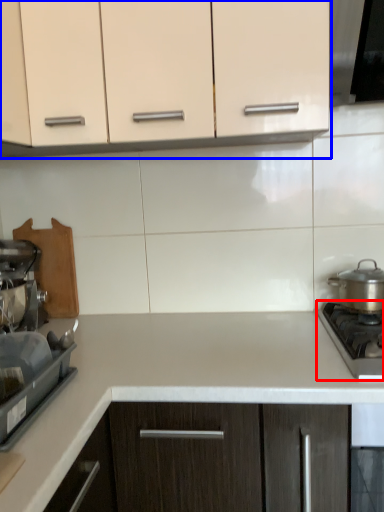
Question: Which point is closer to the camera, gas stove (highlighted by a red box) or cabinetry (highlighted by a blue box)?

Choices:
 (A) gas stove
 (B) cabinetry

Answer: (A)